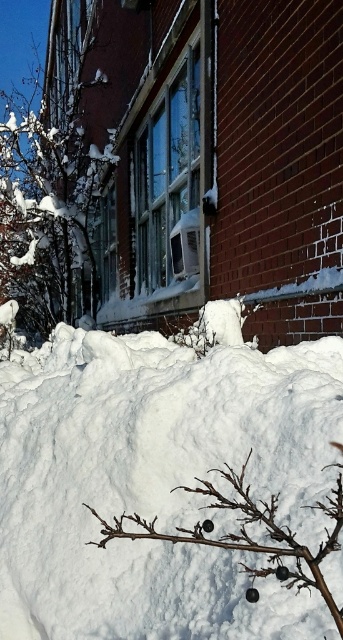
You are standing in the snowy urban scene and want to know how far you are from the point marked at coordinates point (72, 200). Can you determine the distance?

The distance of point (72, 200) from the camera is 5.35 meters, so you are 5.35 meters away from that point.